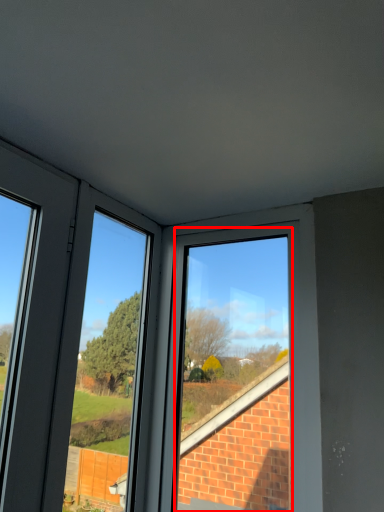
Question: Where is bay window (annotated by the red box) located in relation to window frame in the image?

Choices:
 (A) left
 (B) right

Answer: (B)